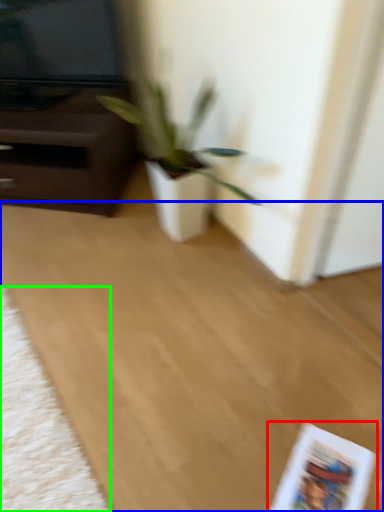
Question: Which is nearer to the paperback book (highlighted by a red box)? plain (highlighted by a blue box) or mat (highlighted by a green box).

Choices:
 (A) plain
 (B) mat

Answer: (A)